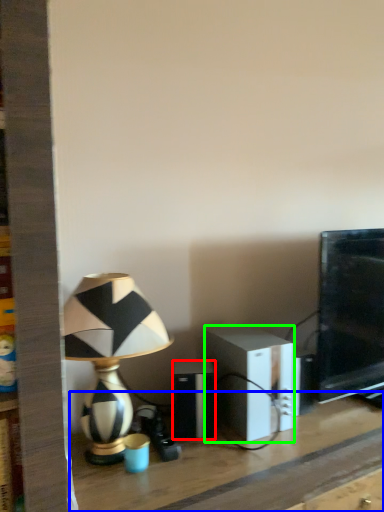
Question: Which object is the farthest from speaker (highlighted by a red box)? Choose among these: table (highlighted by a blue box) or speaker (highlighted by a green box).

Choices:
 (A) table
 (B) speaker

Answer: (A)